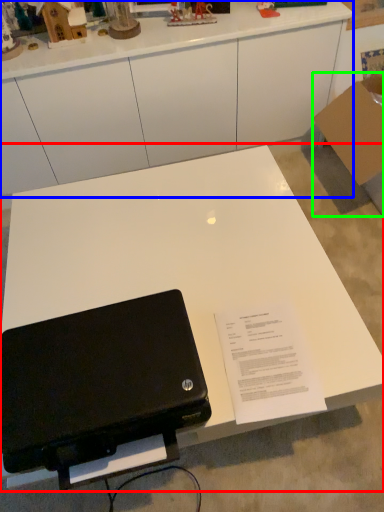
Question: Which object is positioned farthest from table (highlighted by a red box)? Select from desk (highlighted by a blue box) and cardboard box (highlighted by a green box).

Choices:
 (A) desk
 (B) cardboard box

Answer: (B)